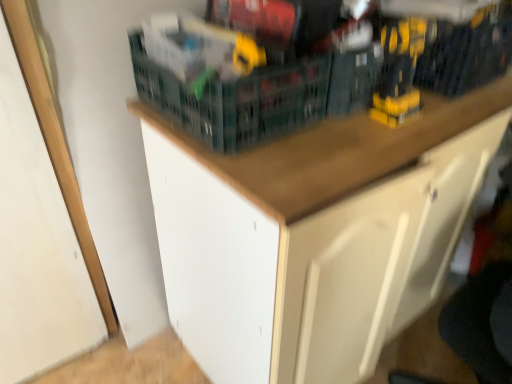
You are a GUI agent. You are given a task and a screenshot of the screen. Output one action in this format:
    pyautogui.click(x=<x>, y=<y>)
    Task: Click on the vacant space in front of yellow plastic drill at upper right, the 1th toy viewed from the right
    Image resolution: width=512 pixels, height=384 pixels.
    Given the screenshot: What is the action you would take?
    pyautogui.click(x=405, y=136)